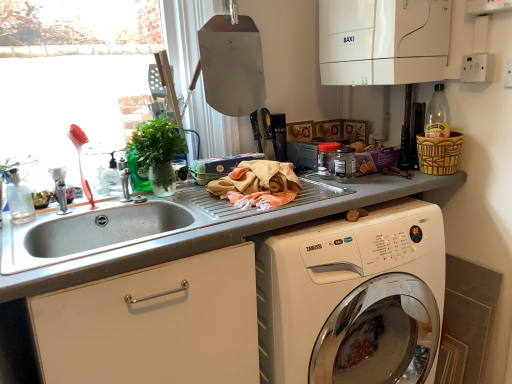
You are a GUI agent. You are given a task and a screenshot of the screen. Output one action in this format:
    pyautogui.click(x=<x>, y=<y>)
    Task: Click on the vacant point to the right of transparent glass jar at center, acting as the first appliance starting from the bottom
    This screenshot has width=512, height=384.
    Given the screenshot: What is the action you would take?
    pyautogui.click(x=393, y=179)